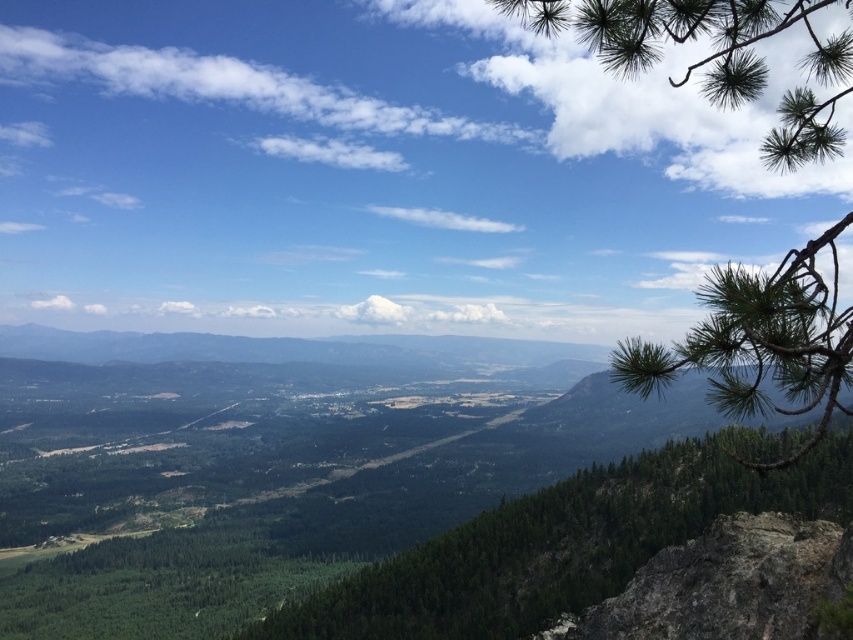
You are standing at the rocky outcrop in the foreground and want to take a photo of the green textured tree at center. Which direction should you face to ensure the tree is centered in your camera view?

The green textured tree at center is located at point coordinates, so you should face towards the center of the image to capture it in your photo.